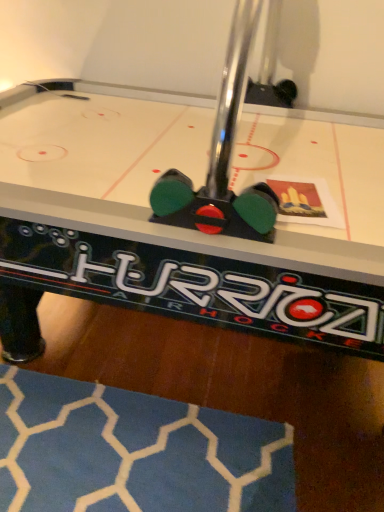
Question: Does point (102, 472) appear closer or farther from the camera than point (82, 146)?

Choices:
 (A) closer
 (B) farther

Answer: (A)

Question: Would you say blue fabric rug at lower left is inside or outside white glossy air hockey table at center?

Choices:
 (A) inside
 (B) outside

Answer: (A)

Question: Is blue fabric rug at lower left wider or thinner than white glossy air hockey table at center?

Choices:
 (A) wide
 (B) thin

Answer: (B)

Question: From a real-world perspective, is white glossy air hockey table at center above or below blue fabric rug at lower left?

Choices:
 (A) below
 (B) above

Answer: (B)

Question: Is white glossy air hockey table at center inside or outside of blue fabric rug at lower left?

Choices:
 (A) inside
 (B) outside

Answer: (B)

Question: In the image, is white glossy air hockey table at center on the left side or the right side of blue fabric rug at lower left?

Choices:
 (A) left
 (B) right

Answer: (B)

Question: From the image's perspective, is white glossy air hockey table at center positioned above or below blue fabric rug at lower left?

Choices:
 (A) below
 (B) above

Answer: (B)